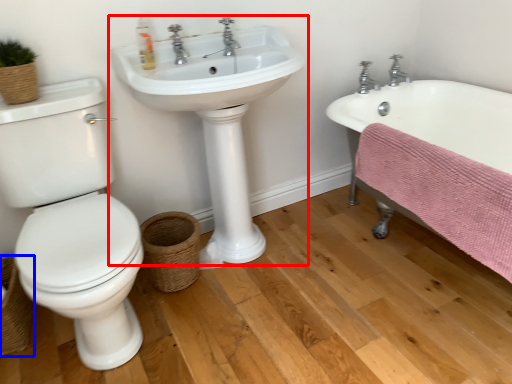
Question: Which point is further to the camera, sink (highlighted by a red box) or basket (highlighted by a blue box)?

Choices:
 (A) sink
 (B) basket

Answer: (B)